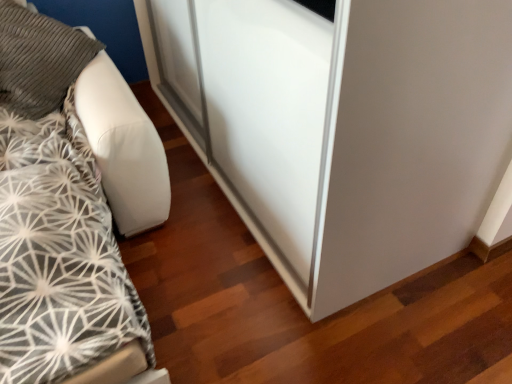
Image resolution: width=512 pixels, height=384 pixels. Find the location of `textured corduroy pillow at left`. textured corduroy pillow at left is located at coordinates (39, 60).

Describe the element at coordinates (39, 60) in the screenshot. I see `textured corduroy pillow at left` at that location.

In order to face textured corduroy pillow at left, should I rotate leftwards or rightwards?

Turn left approximately 29.909 degrees to face it.

The image size is (512, 384). I want to click on textured corduroy pillow at left, so click(x=39, y=60).